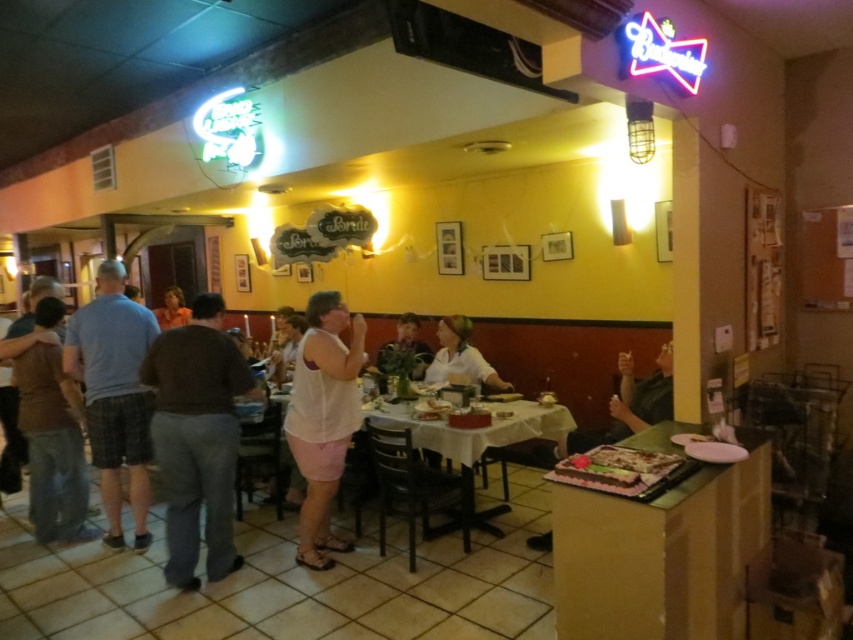
You are a chef who just entered the restaurant and needs to place a new dessert menu board. The board is 20 cm tall. You see the chocolate cake at right and the orange fabric shirt at center. Which object is taller than the dessert menu board?

The chocolate cake at right is taller than the orange fabric shirt at center, so the chocolate cake at right is taller than the dessert menu board.